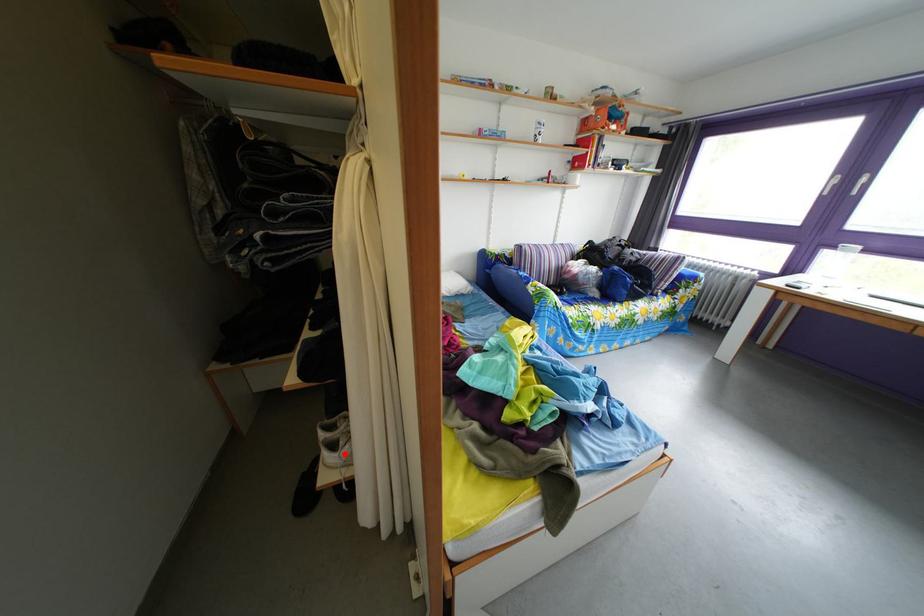
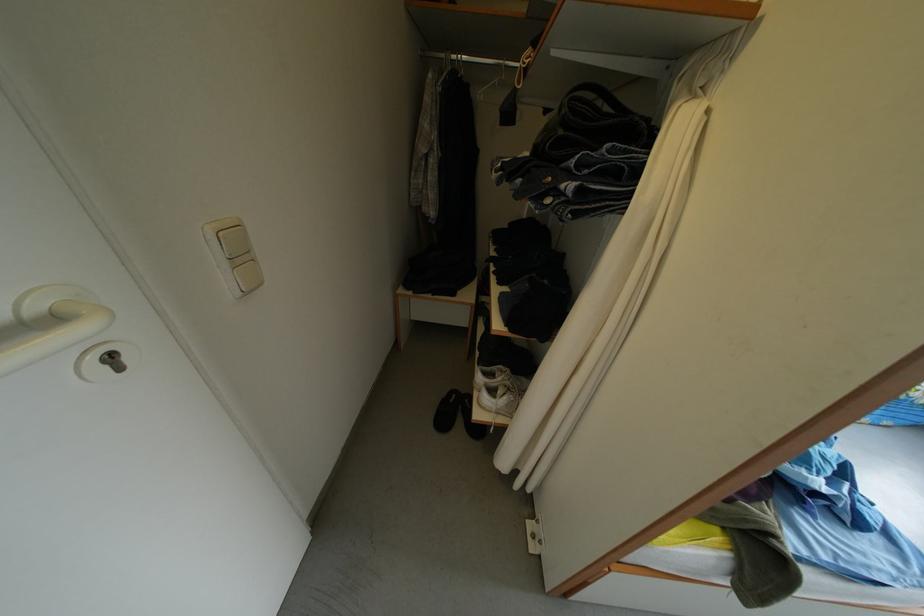
Where in the second image is the point corresponding to the highlighted location from the first image?

(503, 400)